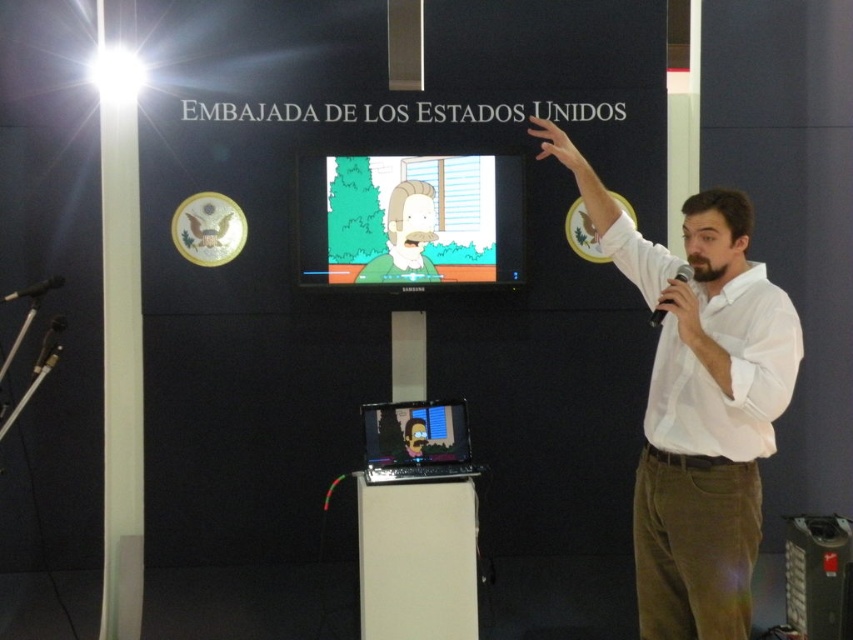
Is matte black screen at center smaller than matte black hand at upper center?

Yes.

Who is lower down, matte black screen at center or matte black hand at upper center?

matte black screen at center

Which is behind, point (415, 456) or point (543, 156)?

The point (415, 456) is behind.

You are a GUI agent. You are given a task and a screenshot of the screen. Output one action in this format:
    pyautogui.click(x=<x>, y=<y>)
    Task: Click on the matte black screen at center
    The height and width of the screenshot is (640, 853).
    Given the screenshot: What is the action you would take?
    pyautogui.click(x=415, y=433)

Between matte black laptop at right and black matte microphone at left, which one appears on the left side from the viewer's perspective?

black matte microphone at left

Does point (843, 552) lie behind point (61, 275)?

No.

Find the location of a particular element. matte black laptop at right is located at coordinates (816, 573).

Does cartoonish plastic tv at center have a greater height compared to black plastic microphone at upper right?

Yes.

Who is positioned more to the right, cartoonish plastic tv at center or black plastic microphone at upper right?

black plastic microphone at upper right is more to the right.

Which is behind, point (502, 202) or point (659, 324)?

The point (502, 202) is more distant.

Find the location of `cartoonish plastic tv at center`. cartoonish plastic tv at center is located at coordinates (409, 220).